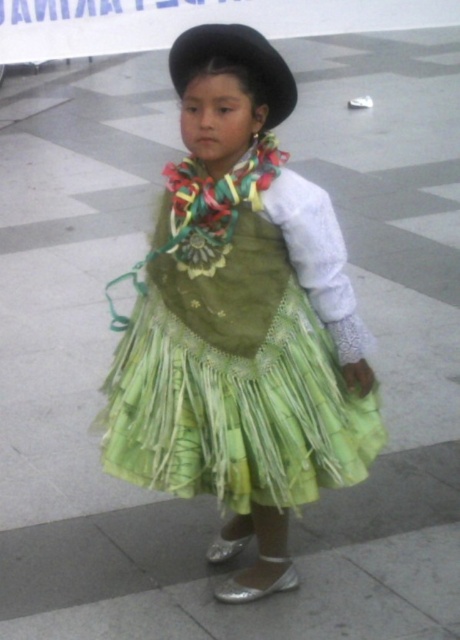
Question: Does green woven dress at center appear on the right side of black felt hat at upper center?

Choices:
 (A) yes
 (B) no

Answer: (A)

Question: Is green woven dress at center to the left of black felt hat at upper center from the viewer's perspective?

Choices:
 (A) no
 (B) yes

Answer: (A)

Question: Is green woven dress at center wider than black felt hat at upper center?

Choices:
 (A) no
 (B) yes

Answer: (B)

Question: Which point appears farthest from the camera in this image?

Choices:
 (A) (241, 33)
 (B) (179, 204)

Answer: (B)

Question: Which object is farther from the camera taking this photo?

Choices:
 (A) black felt hat at upper center
 (B) green woven dress at center

Answer: (B)